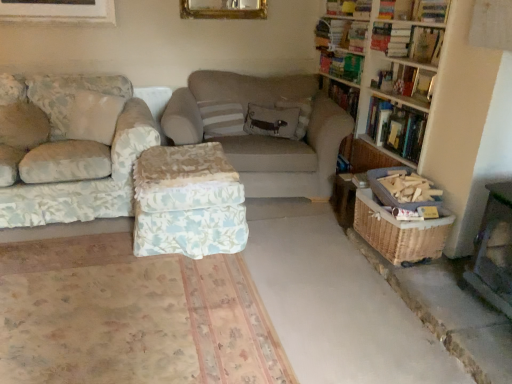
This screenshot has width=512, height=384. I want to click on vacant space to the right of floral fabric ottoman at center, so click(286, 241).